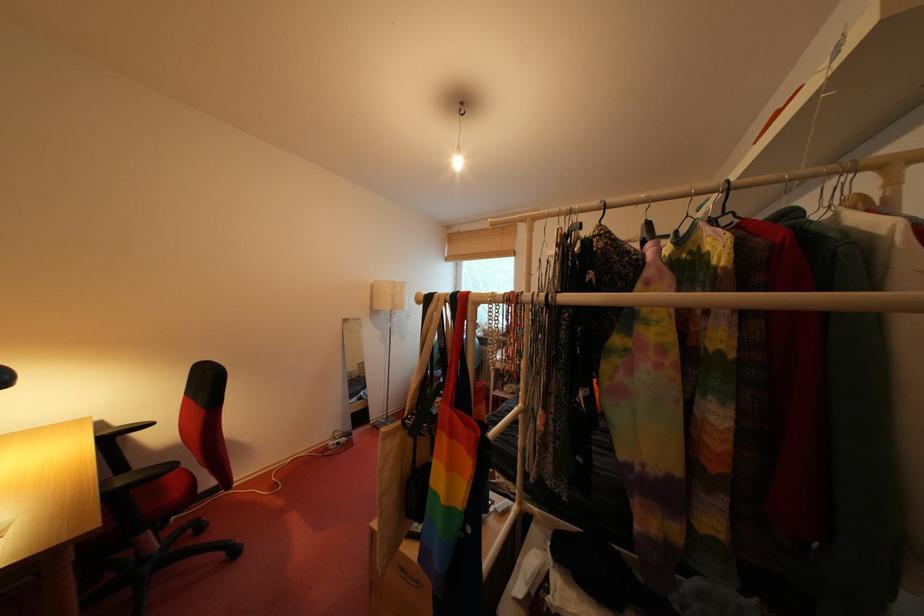
What do you see at coordinates (173, 488) in the screenshot? This screenshot has height=616, width=924. I see `the red chair sitting surface` at bounding box center [173, 488].